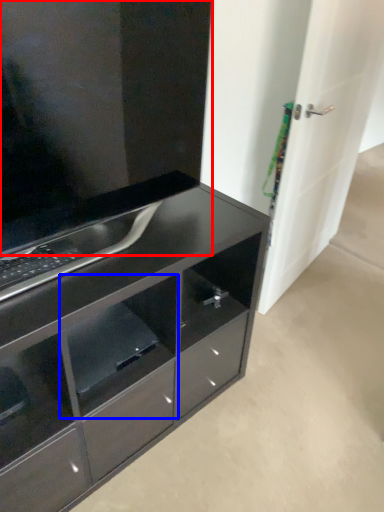
Question: Which object appears farthest to the camera in this image, cabinetry (highlighted by a red box) or shelf (highlighted by a blue box)?

Choices:
 (A) cabinetry
 (B) shelf

Answer: (B)